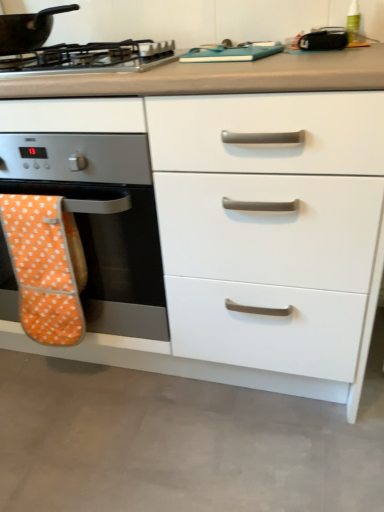
Question: Does point (6, 194) appear closer or farther from the camera than point (349, 352)?

Choices:
 (A) closer
 (B) farther

Answer: (B)

Question: From a real-world perspective, is orange polka dot oven mitt at left positioned above or below white glossy drawer at center?

Choices:
 (A) below
 (B) above

Answer: (A)

Question: Which object is the closest to the black matte pan at upper left?

Choices:
 (A) orange fabric oven mitt at left
 (B) metallic silver gas stove at upper left
 (C) orange polka dot oven mitt at left
 (D) white glossy drawer at center

Answer: (B)

Question: Considering the real-world distances, which object is farthest from the orange polka dot oven mitt at left?

Choices:
 (A) black matte pan at upper left
 (B) white glossy drawer at center
 (C) metallic silver gas stove at upper left
 (D) orange fabric oven mitt at left

Answer: (A)